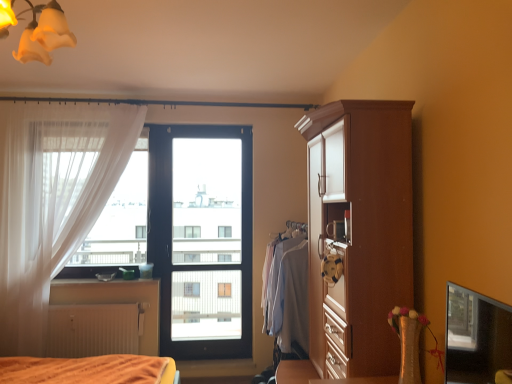
Locate an element on the screen. transparent glass window screen at lower right is located at coordinates (476, 336).

Describe the element at coordinates (289, 294) in the screenshot. Image resolution: width=512 pixels, height=384 pixels. I see `light blue fabric shirt at center` at that location.

Image resolution: width=512 pixels, height=384 pixels. I want to click on transparent glass screen door at center, so click(x=202, y=238).

In the image, is light blue fabric shirt at center on the left side or the right side of matte wood cupboard at right?

In the image, light blue fabric shirt at center appears on the left side of matte wood cupboard at right.

From the image's perspective, which is above, light blue fabric shirt at center or matte wood cupboard at right?

matte wood cupboard at right, from the image's perspective.

Considering the sizes of objects light blue fabric shirt at center and matte wood cupboard at right in the image provided, who is taller, light blue fabric shirt at center or matte wood cupboard at right?

matte wood cupboard at right is taller.

Which is correct: light blue fabric shirt at center is inside matte wood cupboard at right, or outside of it?

light blue fabric shirt at center cannot be found inside matte wood cupboard at right.

Image resolution: width=512 pixels, height=384 pixels. Find the location of `light fixture on the left of transparent glass window screen at lower right`. light fixture on the left of transparent glass window screen at lower right is located at coordinates (37, 31).

Between transparent glass window screen at lower right and yellow frosted glass light fixture at upper left, which one has smaller width?

transparent glass window screen at lower right is thinner.

Can you tell me how much transparent glass window screen at lower right and yellow frosted glass light fixture at upper left differ in facing direction?

The angle between the facing direction of transparent glass window screen at lower right and the facing direction of yellow frosted glass light fixture at upper left is 98.5 degrees.

Does transparent glass window screen at lower right touch yellow frosted glass light fixture at upper left?

transparent glass window screen at lower right and yellow frosted glass light fixture at upper left are not in contact.

I want to click on light fixture above the light blue fabric shirt at center (from the image's perspective), so click(37, 31).

What's the angular difference between light blue fabric shirt at center and yellow frosted glass light fixture at upper left's facing directions?

They differ by 91.8 degrees in their facing directions.

Can you confirm if light blue fabric shirt at center is shorter than yellow frosted glass light fixture at upper left?

No, light blue fabric shirt at center is not shorter than yellow frosted glass light fixture at upper left.

From the image's perspective, is light blue fabric shirt at center above or below yellow frosted glass light fixture at upper left?

Clearly, from the image's perspective, light blue fabric shirt at center is below yellow frosted glass light fixture at upper left.

From a real-world perspective, between matte wood cupboard at right and light blue fabric shirt at center, who is vertically higher?

matte wood cupboard at right is physically above.

Is matte wood cupboard at right not near light blue fabric shirt at center?

Actually, matte wood cupboard at right and light blue fabric shirt at center are a little close together.

Is matte wood cupboard at right positioned in front of light blue fabric shirt at center?

That is True.

Between matte wood cupboard at right and light blue fabric shirt at center, which one appears on the right side from the viewer's perspective?

From the viewer's perspective, matte wood cupboard at right appears more on the right side.

Between yellow frosted glass light fixture at upper left and matte wood cupboard at right, which one has larger size?

matte wood cupboard at right is bigger.

Does point (64, 22) come behind point (339, 281)?

No, it is in front of (339, 281).

Which is behind, yellow frosted glass light fixture at upper left or matte wood cupboard at right?

matte wood cupboard at right is behind.

From the image's perspective, which is below, yellow frosted glass light fixture at upper left or matte wood cupboard at right?

matte wood cupboard at right is shown below in the image.

Based on the photo, can you confirm if metallic silver toaster at upper center is smaller than transparent glass screen door at center?

Yes, metallic silver toaster at upper center is smaller than transparent glass screen door at center.

Between metallic silver toaster at upper center and transparent glass screen door at center, which one is positioned in front?

Positioned in front is metallic silver toaster at upper center.

Can you confirm if metallic silver toaster at upper center is taller than transparent glass screen door at center?

Incorrect, the height of metallic silver toaster at upper center is not larger of that of transparent glass screen door at center.

Considering the positions of point (67, 278) and point (188, 235), is point (67, 278) closer or farther from the camera than point (188, 235)?

Point (67, 278) is positioned closer to the camera compared to point (188, 235).

Considering the sizes of matte black window sill at lower left and transparent glass screen door at center in the image, is matte black window sill at lower left bigger or smaller than transparent glass screen door at center?

Clearly, matte black window sill at lower left is smaller in size than transparent glass screen door at center.

Find the location of a particular element. Image resolution: width=512 pixels, height=384 pixels. clothing below the matte wood cupboard at right (from the image's perspective) is located at coordinates (289, 294).

Where is `window screen that appears on the right of yellow frosted glass light fixture at upper left`? Image resolution: width=512 pixels, height=384 pixels. window screen that appears on the right of yellow frosted glass light fixture at upper left is located at coordinates (476, 336).

When comparing their distances from metallic silver toaster at upper center, does transparent glass screen door at center or matte black window sill at lower left seem closer?

matte black window sill at lower left lies closer to metallic silver toaster at upper center than the other object.

Looking at this image, looking at the image, which one is located further to light blue fabric shirt at center, white sheer curtain at left or transparent glass window screen at lower right?

white sheer curtain at left lies further to light blue fabric shirt at center than the other object.

From the picture: Based on their spatial positions, is white sheer curtain at left or white matte radiator at lower left closer to metallic silver toaster at upper center?

white matte radiator at lower left is positioned closer to the anchor metallic silver toaster at upper center.

From the image, which object appears to be farther from light blue fabric shirt at center, white matte radiator at lower left or white sheer curtain at left?

Based on the image, white sheer curtain at left appears to be further to light blue fabric shirt at center.

From the image, which object appears to be nearer to metallic silver toaster at upper center, white sheer curtain at left or matte wood cupboard at right?

matte wood cupboard at right is positioned closer to the anchor metallic silver toaster at upper center.

Based on their spatial positions, is white matte radiator at lower left or transparent glass screen door at center closer to matte wood cupboard at right?

white matte radiator at lower left.

From the picture: Estimate the real-world distances between objects in this image. Which object is closer to light blue fabric shirt at center, matte wood cupboard at right or transparent glass screen door at center?

matte wood cupboard at right lies closer to light blue fabric shirt at center than the other object.

Estimate the real-world distances between objects in this image. Which object is closer to transparent glass screen door at center, white matte radiator at lower left or matte black window sill at lower left?

The object closer to transparent glass screen door at center is matte black window sill at lower left.

At what (x,y) coordinates should I click in order to perform the action: click on clothing between matte black window sill at lower left and metallic silver toaster at upper center. Please return your answer as a coordinate pair (x, y). The width and height of the screenshot is (512, 384). Looking at the image, I should click on (289, 294).

Find the location of a particular element. The height and width of the screenshot is (384, 512). curtain between matte wood cupboard at right and transparent glass screen door at center along the z-axis is located at coordinates (52, 201).

Where is `appliance between yellow frosted glass light fixture at upper left and transparent glass screen door at center from front to back`? The width and height of the screenshot is (512, 384). appliance between yellow frosted glass light fixture at upper left and transparent glass screen door at center from front to back is located at coordinates (336, 230).

What are the coordinates of `light fixture positioned between transparent glass window screen at lower right and white matte radiator at lower left from near to far` in the screenshot? It's located at (37, 31).